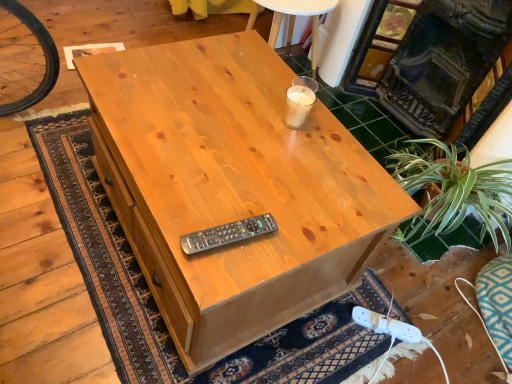
Question: Looking at the image, does dark gray stone fireplace at upper right seem bigger or smaller compared to black plastic remote at center?

Choices:
 (A) small
 (B) big

Answer: (B)

Question: From the image's perspective, relative to black plastic remote at center, is dark gray stone fireplace at upper right above or below?

Choices:
 (A) above
 (B) below

Answer: (A)

Question: Estimate the real-world distances between objects in this image. Which object is farther from the white plastic plug at lower right?

Choices:
 (A) dark gray stone fireplace at upper right
 (B) black plastic remote at center
 (C) natural wood desk at center

Answer: (A)

Question: Which object is the farthest from the black plastic remote at center?

Choices:
 (A) dark gray stone fireplace at upper right
 (B) natural wood desk at center
 (C) white plastic plug at lower right

Answer: (A)